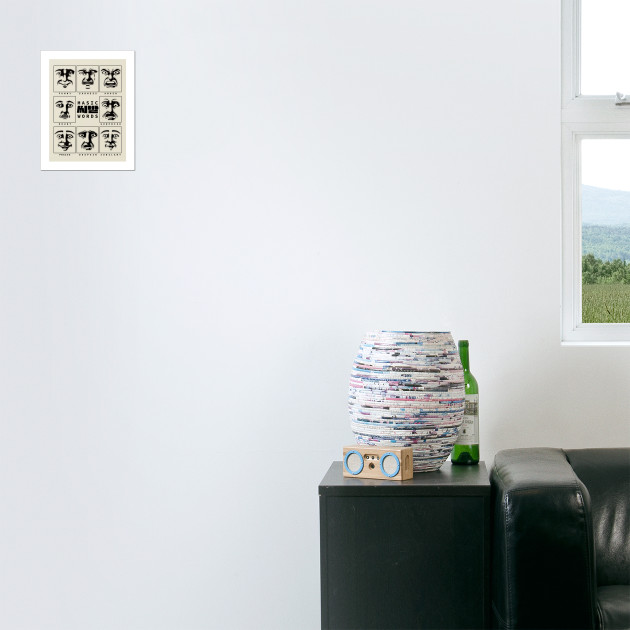
Locate an element on the screen. This screenshot has width=630, height=630. corners of window panes is located at coordinates (587, 323), (578, 140), (581, 91).